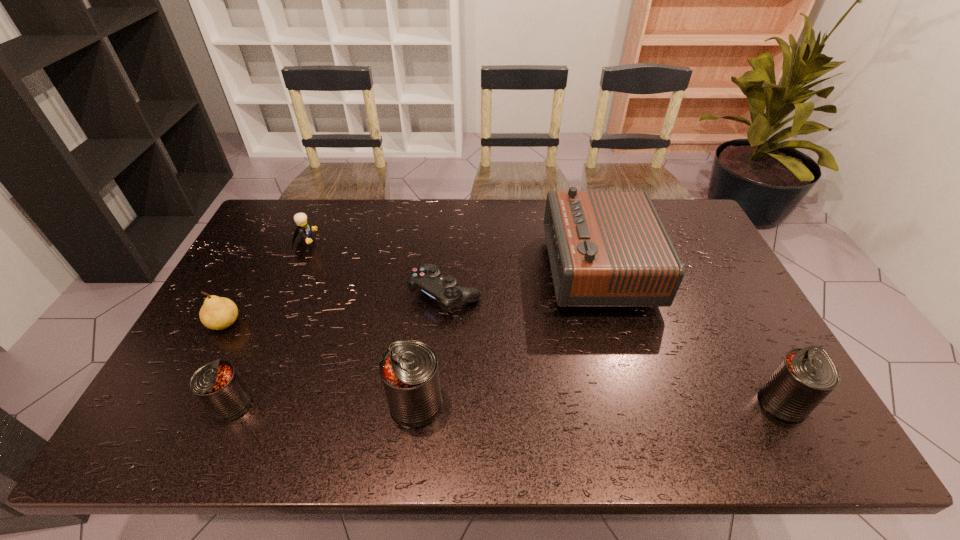
Identify the location of vacant space located on the left of the rightmost can. The height and width of the screenshot is (540, 960). (705, 402).

The image size is (960, 540). What are the coordinates of `vacant space located 0.350m on the front-facing side of the Lego` in the screenshot? It's located at (421, 242).

Identify the location of vacant area situated on the front panel of the radio receiver. The image size is (960, 540). (491, 268).

The height and width of the screenshot is (540, 960). I want to click on vacant region located on the front panel of the radio receiver, so click(423, 268).

Identify the location of free space located on the front panel of the radio receiver. (532, 268).

You are a GUI agent. You are given a task and a screenshot of the screen. Output one action in this format:
    pyautogui.click(x=<x>, y=<y>)
    Task: Click on the vacant space located on the back of the control
    Image resolution: width=960 pixels, height=540 pixels.
    Given the screenshot: What is the action you would take?
    pyautogui.click(x=449, y=247)

Find the location of a particular element. This screenshot has height=540, width=960. vacant region located on the right of the pear is located at coordinates (288, 323).

Locate an element on the screen. The image size is (960, 540). Lego at the far edge is located at coordinates (304, 228).

At what (x,y) coordinates should I click in order to perform the action: click on radio receiver that is at the far edge. Please return your answer as a coordinate pair (x, y). Looking at the image, I should click on (606, 248).

Locate an element on the screen. can that is at the left edge is located at coordinates (217, 385).